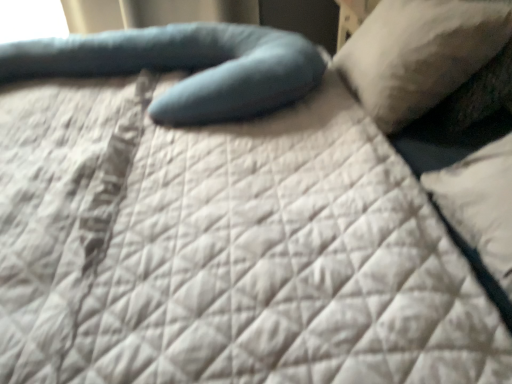
Measure the distance between point [499,19] and camera.

They are 3.35 feet apart.

This screenshot has width=512, height=384. What do you see at coordinates (419, 54) in the screenshot? I see `white soft pillow at upper right, which ranks as the second pillow in left-to-right order` at bounding box center [419, 54].

Identify the location of white soft pillow at upper right, which ranks as the second pillow in left-to-right order. This screenshot has width=512, height=384. (419, 54).

Measure the distance between point [212,113] and camera.

The distance of point [212,113] from camera is 3.65 feet.

You are a GUI agent. You are given a task and a screenshot of the screen. Output one action in this format:
    pyautogui.click(x=<x>, y=<y>)
    Task: Click on the teal fabric pillow at center, the 1th pillow viewed from the left
    The image size is (512, 384).
    Given the screenshot: What is the action you would take?
    pyautogui.click(x=184, y=66)

Image resolution: width=512 pixels, height=384 pixels. Describe the element at coordinates (184, 66) in the screenshot. I see `teal fabric pillow at center, marked as the second pillow in a right-to-left arrangement` at that location.

Where is `white soft pillow at upper right, which ranks as the second pillow in left-to-right order`? The height and width of the screenshot is (384, 512). white soft pillow at upper right, which ranks as the second pillow in left-to-right order is located at coordinates (419, 54).

Does teal fabric pillow at center, the 1th pillow viewed from the left, appear on the right side of white soft pillow at upper right, acting as the first pillow starting from the right?

Incorrect, teal fabric pillow at center, the 1th pillow viewed from the left, is not on the right side of white soft pillow at upper right, acting as the first pillow starting from the right.

In the image, is teal fabric pillow at center, marked as the second pillow in a right-to-left arrangement, positioned in front of or behind white soft pillow at upper right, acting as the first pillow starting from the right?

Clearly, teal fabric pillow at center, marked as the second pillow in a right-to-left arrangement, is behind white soft pillow at upper right, acting as the first pillow starting from the right.

Between point (207, 79) and point (411, 10), which one is positioned in front?

The point (207, 79) is in front.

From the image's perspective, which is below, teal fabric pillow at center, marked as the second pillow in a right-to-left arrangement, or white soft pillow at upper right, which ranks as the second pillow in left-to-right order?

teal fabric pillow at center, marked as the second pillow in a right-to-left arrangement.

From a real-world perspective, is teal fabric pillow at center, the 1th pillow viewed from the left, positioned over white soft pillow at upper right, which ranks as the second pillow in left-to-right order, based on gravity?

No, from a real-world perspective, teal fabric pillow at center, the 1th pillow viewed from the left, is not over white soft pillow at upper right, which ranks as the second pillow in left-to-right order

Does teal fabric pillow at center, the 1th pillow viewed from the left, have a lesser width compared to white soft pillow at upper right, which ranks as the second pillow in left-to-right order?

No.

Who is shorter, teal fabric pillow at center, marked as the second pillow in a right-to-left arrangement, or white soft pillow at upper right, which ranks as the second pillow in left-to-right order?

teal fabric pillow at center, marked as the second pillow in a right-to-left arrangement, is shorter.

Is teal fabric pillow at center, the 1th pillow viewed from the left, bigger or smaller than white soft pillow at upper right, which ranks as the second pillow in left-to-right order?

teal fabric pillow at center, the 1th pillow viewed from the left, is bigger than white soft pillow at upper right, which ranks as the second pillow in left-to-right order.

Is teal fabric pillow at center, marked as the second pillow in a right-to-left arrangement, inside or outside of white soft pillow at upper right, which ranks as the second pillow in left-to-right order?

teal fabric pillow at center, marked as the second pillow in a right-to-left arrangement, is outside white soft pillow at upper right, which ranks as the second pillow in left-to-right order.

Are teal fabric pillow at center, marked as the second pillow in a right-to-left arrangement, and white soft pillow at upper right, acting as the first pillow starting from the right, making contact?

No, teal fabric pillow at center, marked as the second pillow in a right-to-left arrangement, is not making contact with white soft pillow at upper right, acting as the first pillow starting from the right.

Is teal fabric pillow at center, the 1th pillow viewed from the left, turned away from white soft pillow at upper right, acting as the first pillow starting from the right?

Yes, white soft pillow at upper right, acting as the first pillow starting from the right, is at the back of teal fabric pillow at center, the 1th pillow viewed from the left.

In the image, there is a white soft pillow at upper right, which ranks as the second pillow in left-to-right order. Find the location of `pillow below it (from the image's perspective)`. pillow below it (from the image's perspective) is located at coordinates (184, 66).

Does white soft pillow at upper right, which ranks as the second pillow in left-to-right order, appear on the right side of teal fabric pillow at center, marked as the second pillow in a right-to-left arrangement?

Indeed, white soft pillow at upper right, which ranks as the second pillow in left-to-right order, is positioned on the right side of teal fabric pillow at center, marked as the second pillow in a right-to-left arrangement.

Between white soft pillow at upper right, which ranks as the second pillow in left-to-right order, and teal fabric pillow at center, marked as the second pillow in a right-to-left arrangement, which one is positioned behind?

teal fabric pillow at center, marked as the second pillow in a right-to-left arrangement.

Does point (454, 33) come behind point (249, 41)?

No, it is not.

From the image's perspective, is white soft pillow at upper right, which ranks as the second pillow in left-to-right order, positioned above or below teal fabric pillow at center, marked as the second pillow in a right-to-left arrangement?

Clearly, from the image's perspective, white soft pillow at upper right, which ranks as the second pillow in left-to-right order, is above teal fabric pillow at center, marked as the second pillow in a right-to-left arrangement.

From a real-world perspective, is white soft pillow at upper right, acting as the first pillow starting from the right, located higher than teal fabric pillow at center, marked as the second pillow in a right-to-left arrangement?

Yes, from a real-world perspective, white soft pillow at upper right, acting as the first pillow starting from the right, is on top of teal fabric pillow at center, marked as the second pillow in a right-to-left arrangement.

Considering the relative sizes of white soft pillow at upper right, which ranks as the second pillow in left-to-right order, and teal fabric pillow at center, the 1th pillow viewed from the left, in the image provided, is white soft pillow at upper right, which ranks as the second pillow in left-to-right order, thinner than teal fabric pillow at center, the 1th pillow viewed from the left,?

Indeed, white soft pillow at upper right, which ranks as the second pillow in left-to-right order, has a lesser width compared to teal fabric pillow at center, the 1th pillow viewed from the left.

From the picture: Is white soft pillow at upper right, which ranks as the second pillow in left-to-right order, shorter than teal fabric pillow at center, the 1th pillow viewed from the left?

No.

Considering the relative sizes of white soft pillow at upper right, acting as the first pillow starting from the right, and teal fabric pillow at center, the 1th pillow viewed from the left, in the image provided, is white soft pillow at upper right, acting as the first pillow starting from the right, bigger than teal fabric pillow at center, the 1th pillow viewed from the left,?

Incorrect, white soft pillow at upper right, acting as the first pillow starting from the right, is not larger than teal fabric pillow at center, the 1th pillow viewed from the left.

Would you say teal fabric pillow at center, marked as the second pillow in a right-to-left arrangement, is part of white soft pillow at upper right, acting as the first pillow starting from the right,'s contents?

No, teal fabric pillow at center, marked as the second pillow in a right-to-left arrangement, is located outside of white soft pillow at upper right, acting as the first pillow starting from the right.

Looking at this image, is white soft pillow at upper right, acting as the first pillow starting from the right, next to teal fabric pillow at center, marked as the second pillow in a right-to-left arrangement, and touching it?

They are not placed beside each other.

Is white soft pillow at upper right, which ranks as the second pillow in left-to-right order, turned away from teal fabric pillow at center, the 1th pillow viewed from the left?

No, white soft pillow at upper right, which ranks as the second pillow in left-to-right order, is not facing away from teal fabric pillow at center, the 1th pillow viewed from the left.

I want to click on pillow located underneath the white soft pillow at upper right, which ranks as the second pillow in left-to-right order (from a real-world perspective), so click(x=184, y=66).

In order to click on pillow in front of the teal fabric pillow at center, the 1th pillow viewed from the left in this screenshot , I will do `click(419, 54)`.

Identify the location of pillow that is above the teal fabric pillow at center, marked as the second pillow in a right-to-left arrangement (from the image's perspective). (419, 54).